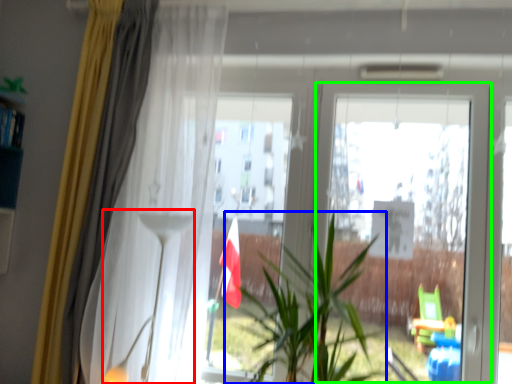
Question: Which object is positioned closest to lamp (highlighted by a red box)? Select from houseplant (highlighted by a blue box) and screen door (highlighted by a green box).

Choices:
 (A) houseplant
 (B) screen door

Answer: (A)